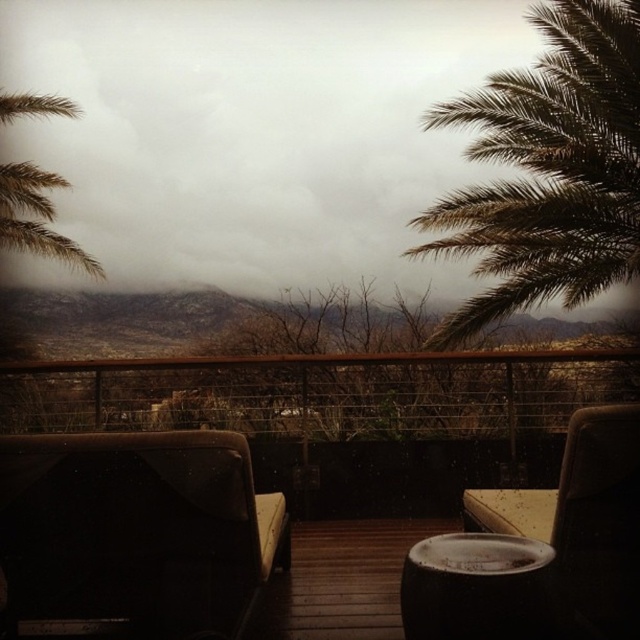
What do you see at coordinates (476, 588) in the screenshot?
I see `smooth dark brown stool at center` at bounding box center [476, 588].

From the picture: Who is lower down, smooth dark brown stool at center or green leafy palm tree at left?

smooth dark brown stool at center is below.

The image size is (640, 640). What do you see at coordinates (476, 588) in the screenshot? I see `smooth dark brown stool at center` at bounding box center [476, 588].

Locate an element on the screen. This screenshot has width=640, height=640. smooth dark brown stool at center is located at coordinates (476, 588).

Does dark brown leather armchair at lower left have a greater height compared to green leafy palm tree at left?

No.

Who is shorter, dark brown leather armchair at lower left or green leafy palm tree at left?

Standing shorter between the two is dark brown leather armchair at lower left.

The height and width of the screenshot is (640, 640). I want to click on dark brown leather armchair at lower left, so click(134, 534).

Looking at this image, is wooden deck at center further to the viewer compared to green leafy palm tree at left?

No.

Between point (278, 618) and point (28, 99), which one is positioned in front?

Point (278, 618) is more forward.

Where is `wooden deck at center`? The height and width of the screenshot is (640, 640). wooden deck at center is located at coordinates (340, 580).